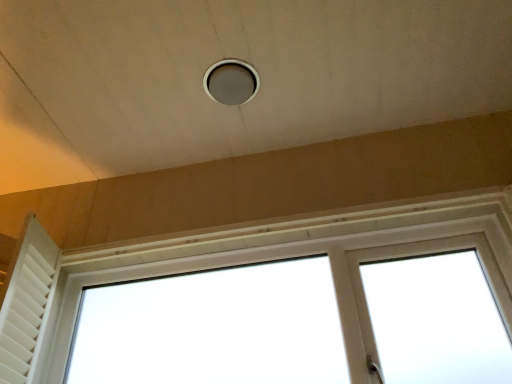
The height and width of the screenshot is (384, 512). Describe the element at coordinates (276, 251) in the screenshot. I see `white plastic window at center` at that location.

Image resolution: width=512 pixels, height=384 pixels. What are the coordinates of `white plastic window at center` in the screenshot? It's located at (276, 251).

What is the approximate height of matte gray hole at center?

It is 3.17 centimeters.

The image size is (512, 384). Find the location of `white plastic window at center`. white plastic window at center is located at coordinates [x=276, y=251].

From a real-world perspective, is matte gray hole at center located beneath white plastic window at center?

Incorrect, from a real-world perspective, matte gray hole at center is higher than white plastic window at center.

Could you tell me if matte gray hole at center is facing white plastic window at center?

No, matte gray hole at center is not facing towards white plastic window at center.

How many degrees apart are the facing directions of matte gray hole at center and white plastic window at center?

They differ by 0.000128 degrees in their facing directions.

Is matte gray hole at center to the left or to the right of white plastic window at center in the image?

From the image, it's evident that matte gray hole at center is to the left of white plastic window at center.

Relative to white matte shutter at left, is white plastic window at center in front or behind?

Visually, white plastic window at center is located in front of white matte shutter at left.

Considering the sizes of objects white plastic window at center and white matte shutter at left in the image provided, who is taller, white plastic window at center or white matte shutter at left?

Standing taller between the two is white plastic window at center.

Which is more to the left, white plastic window at center or white matte shutter at left?

white matte shutter at left is more to the left.

Looking at the image, does white plastic window at center seem bigger or smaller compared to white matte shutter at left?

Clearly, white plastic window at center is larger in size than white matte shutter at left.

Can you confirm if white plastic window at center is positioned to the right of matte gray hole at center?

Yes, white plastic window at center is to the right of matte gray hole at center.

From the image's perspective, is white plastic window at center located beneath matte gray hole at center?

Correct, white plastic window at center appears lower than matte gray hole at center in the image.

Considering the sizes of objects white plastic window at center and matte gray hole at center in the image provided, who is thinner, white plastic window at center or matte gray hole at center?

With smaller width is matte gray hole at center.

Can you confirm if white plastic window at center is bigger than matte gray hole at center?

Yes, white plastic window at center is bigger than matte gray hole at center.

Is white matte shutter at left placed right next to white plastic window at center?

No.

In the scene shown: Considering the sizes of objects white matte shutter at left and white plastic window at center in the image provided, who is thinner, white matte shutter at left or white plastic window at center?

Thinner between the two is white plastic window at center.

How many degrees apart are the facing directions of white matte shutter at left and white plastic window at center?

The angular difference between white matte shutter at left and white plastic window at center is 0.942 degrees.

Based on the photo, considering the sizes of objects white matte shutter at left and white plastic window at center in the image provided, who is bigger, white matte shutter at left or white plastic window at center?

white plastic window at center.

In terms of size, does matte gray hole at center appear bigger or smaller than white matte shutter at left?

Clearly, matte gray hole at center is smaller in size than white matte shutter at left.

Considering the sizes of objects matte gray hole at center and white matte shutter at left in the image provided, who is wider, matte gray hole at center or white matte shutter at left?

Wider between the two is white matte shutter at left.

From the image's perspective, is matte gray hole at center located above or below white matte shutter at left?

Based on their image positions, matte gray hole at center is located above white matte shutter at left.

From a real-world perspective, is matte gray hole at center located beneath white matte shutter at left?

Actually, matte gray hole at center is physically above white matte shutter at left in the real world.

Considering the sizes of objects white matte shutter at left and matte gray hole at center in the image provided, who is wider, white matte shutter at left or matte gray hole at center?

Wider between the two is white matte shutter at left.

From a real-world perspective, is white matte shutter at left physically located above or below matte gray hole at center?

white matte shutter at left is below matte gray hole at center.

Is white matte shutter at left oriented away from matte gray hole at center?

No, white matte shutter at left's orientation is not away from matte gray hole at center.

Find the location of a particular element. window below the matte gray hole at center (from a real-world perspective) is located at coordinates (276, 251).

Where is `window on the right of white matte shutter at left`? window on the right of white matte shutter at left is located at coordinates (276, 251).

Looking at the image, which one is located closer to white matte shutter at left, matte gray hole at center or white plastic window at center?

white plastic window at center.

When comparing their distances from matte gray hole at center, does white plastic window at center or white matte shutter at left seem further?

white matte shutter at left is further to matte gray hole at center.

Considering their positions, is white matte shutter at left positioned closer to matte gray hole at center than white plastic window at center?

Based on the image, white plastic window at center appears to be nearer to matte gray hole at center.

From the picture: Which object lies nearer to the anchor point white matte shutter at left, white plastic window at center or matte gray hole at center?

white plastic window at center lies closer to white matte shutter at left than the other object.

When comparing their distances from white plastic window at center, does matte gray hole at center or white matte shutter at left seem further?

matte gray hole at center is positioned further to the anchor white plastic window at center.

When comparing their distances from white plastic window at center, does white matte shutter at left or matte gray hole at center seem closer?

white matte shutter at left lies closer to white plastic window at center than the other object.

Locate an element on the screen. Image resolution: width=512 pixels, height=384 pixels. hole between white matte shutter at left and white plastic window at center in the horizontal direction is located at coordinates click(231, 82).